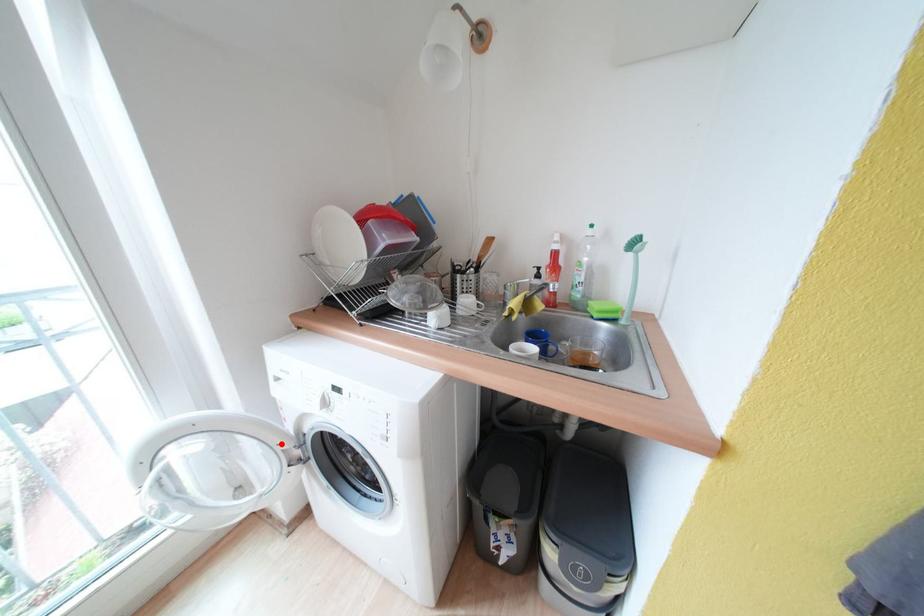
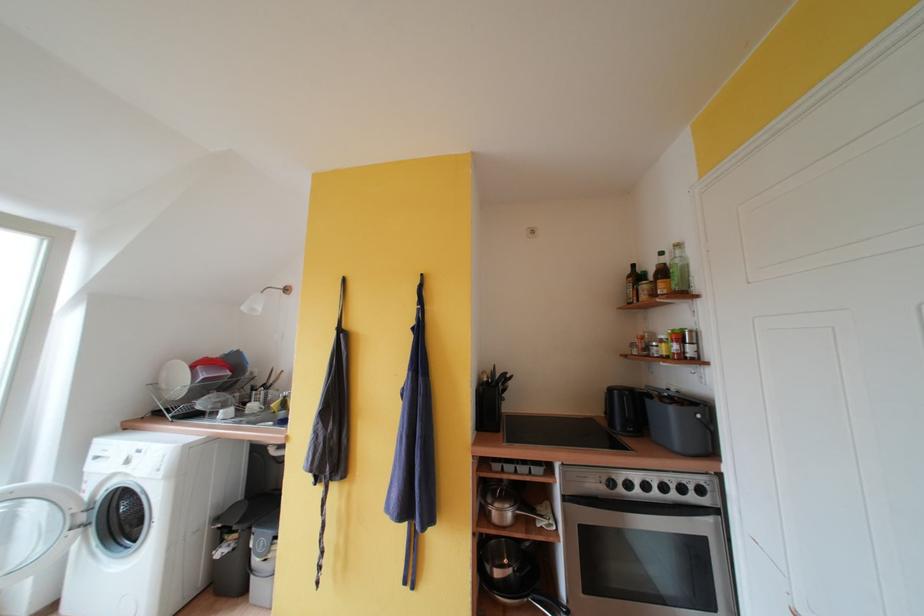
Question: I am providing you with two images of the same scene from different viewpoints. Image1 has a red point marked. In image2, the corresponding 3D location appears at what relative position? Reply with the corresponding letter.

Choices:
 (A) Closer
 (B) Farther

Answer: (A)